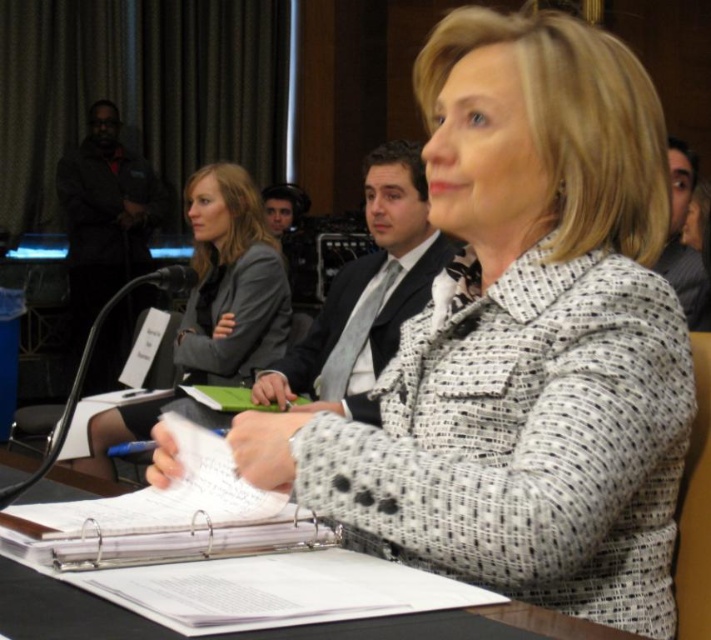
In the scene shown: Based on the scene description, which object is located below the other between the gray fabric jacket at upper left and the black textured suit at center?

The gray fabric jacket at upper left is positioned under the black textured suit at center, meaning it is located below the black textured suit at center.

Based on the scene description, which object, the gray fabric jacket at upper left or the black textured suit at center, is wider?

The gray fabric jacket at upper left might be wider than the black textured suit at center.

You are an observer at the meeting. You notice the gray fabric jacket at upper left and the black paper at center. Which object is covering the other?

The gray fabric jacket at upper left is positioned over the black paper at center, so it is covering the black paper at center.